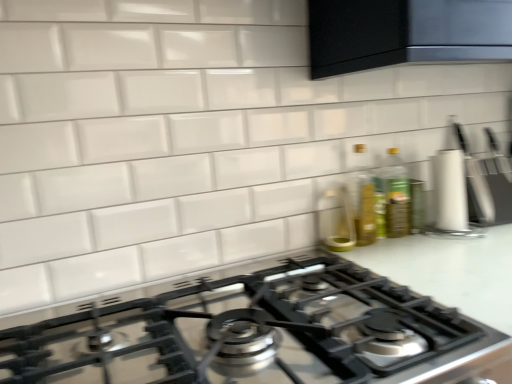
Identify the location of free space in front of clear glass bottle at center. The width and height of the screenshot is (512, 384). (383, 258).